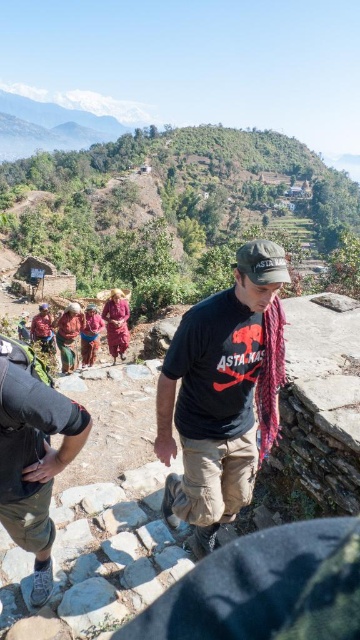
Is point (38, 563) less distant than point (33, 337)?

Yes.

Between matte khaki shorts at lower left and reddish brown fabric at lower left, which one has more height?

matte khaki shorts at lower left is taller.

Identify the location of matte khaki shorts at lower left. The image size is (360, 640). (33, 456).

Find the location of a particular element. The height and width of the screenshot is (640, 360). green grassy hillside at upper center is located at coordinates (177, 189).

Does point (297, 172) come farther from viewer compared to point (34, 502)?

Yes.

This screenshot has height=640, width=360. Describe the element at coordinates (177, 189) in the screenshot. I see `green grassy hillside at upper center` at that location.

Where is `green grassy hillside at upper center`? This screenshot has width=360, height=640. green grassy hillside at upper center is located at coordinates point(177,189).

In the scene shown: Who is taller, green grassy hillside at upper center or matte red scarf at lower left?

green grassy hillside at upper center

Is green grassy hillside at upper center bigger than matte red scarf at lower left?

Yes.

Does point (321, 205) come farther from viewer compared to point (60, 326)?

Yes, it is.

Image resolution: width=360 pixels, height=640 pixels. Find the location of `green grassy hillside at upper center`. green grassy hillside at upper center is located at coordinates (177, 189).